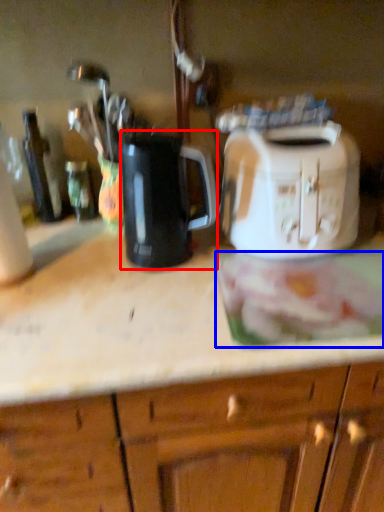
Question: Which point is closer to the camera, kitchen appliance (highlighted by a red box) or food (highlighted by a blue box)?

Choices:
 (A) kitchen appliance
 (B) food

Answer: (B)